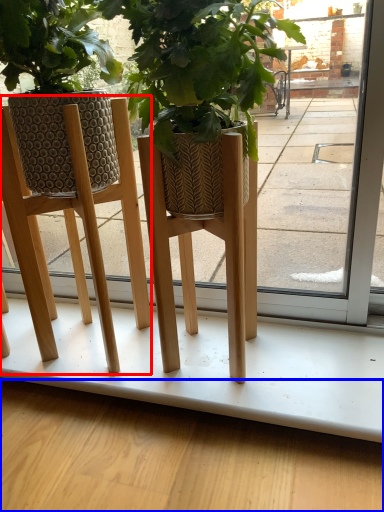
Question: Which point is closer to the camera, furniture (highlighted by a red box) or pavement (highlighted by a blue box)?

Choices:
 (A) furniture
 (B) pavement

Answer: (A)